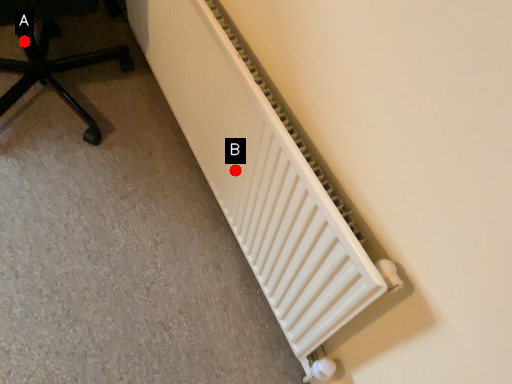
Question: Two points are circled on the image, labeled by A and B beside each circle. Which of the following is the farthest from the observer?

Choices:
 (A) A is further
 (B) B is further

Answer: (A)